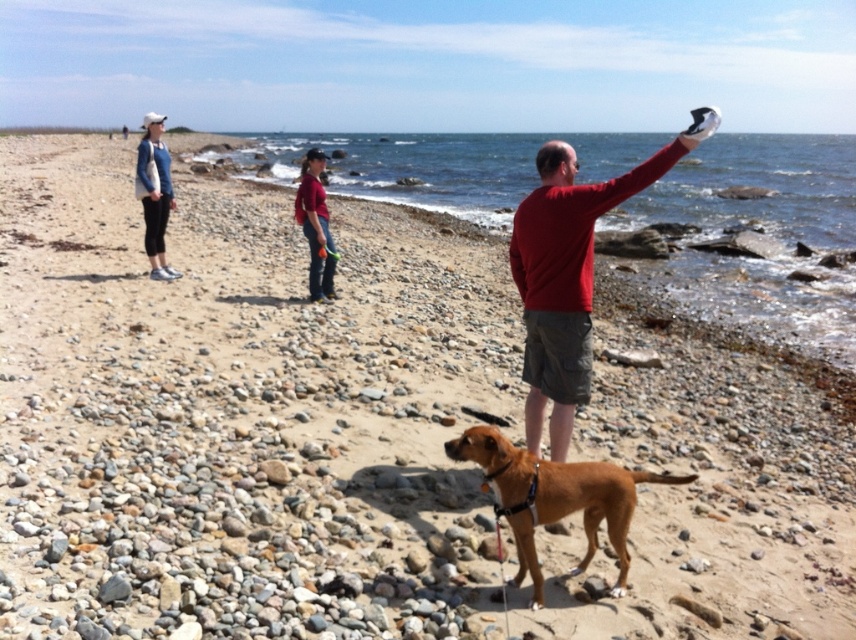
Question: Can you confirm if red matte sweater at center is positioned below matte red shirt at center?

Choices:
 (A) no
 (B) yes

Answer: (B)

Question: Which object is the farthest from the brown leather dog at center?

Choices:
 (A) blue cotton shirt at upper left
 (B) matte red shirt at center
 (C) red matte sweater at center

Answer: (A)

Question: Can you confirm if red matte sweater at center is positioned to the left of brown leather dog at center?

Choices:
 (A) yes
 (B) no

Answer: (B)

Question: In this image, where is brown leather dog at center located relative to blue cotton shirt at upper left?

Choices:
 (A) below
 (B) above

Answer: (A)

Question: Among these objects, which one is farthest from the camera?

Choices:
 (A) matte red shirt at center
 (B) blue cotton shirt at upper left
 (C) red matte sweater at center
 (D) brown leather dog at center

Answer: (B)

Question: Estimate the real-world distances between objects in this image. Which object is closer to the matte red shirt at center?

Choices:
 (A) blue cotton shirt at upper left
 (B) red matte sweater at center

Answer: (A)